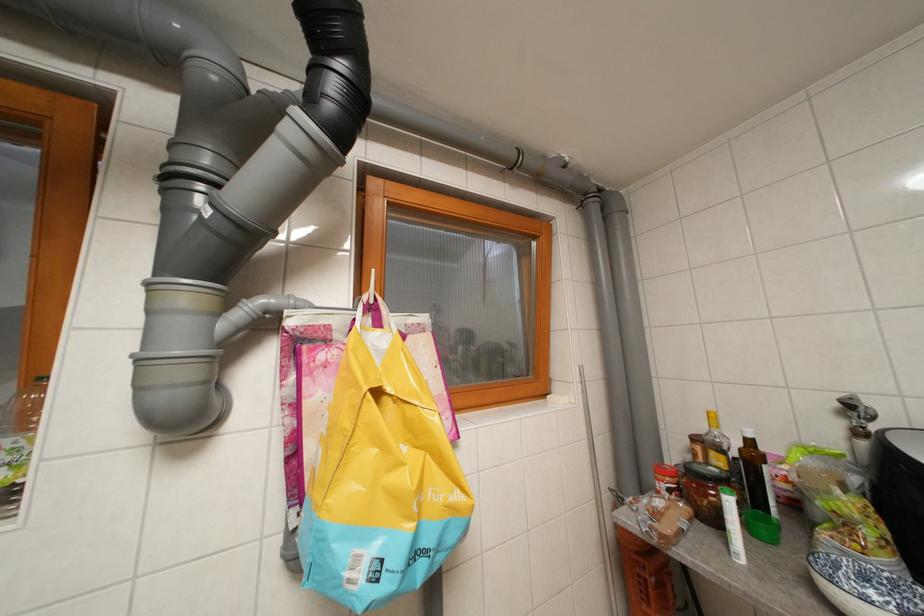
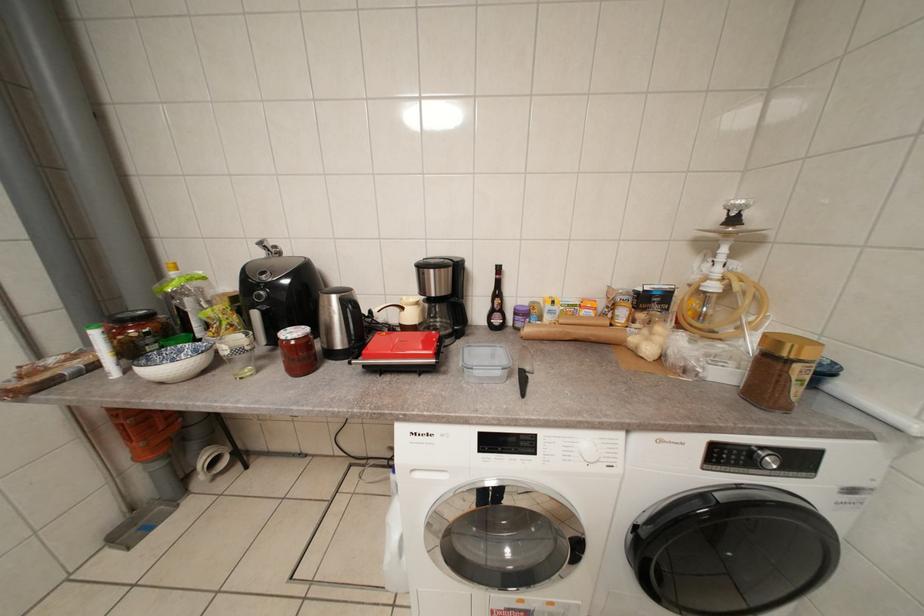
How did the camera likely rotate?

The rotation direction of the camera is right-down.